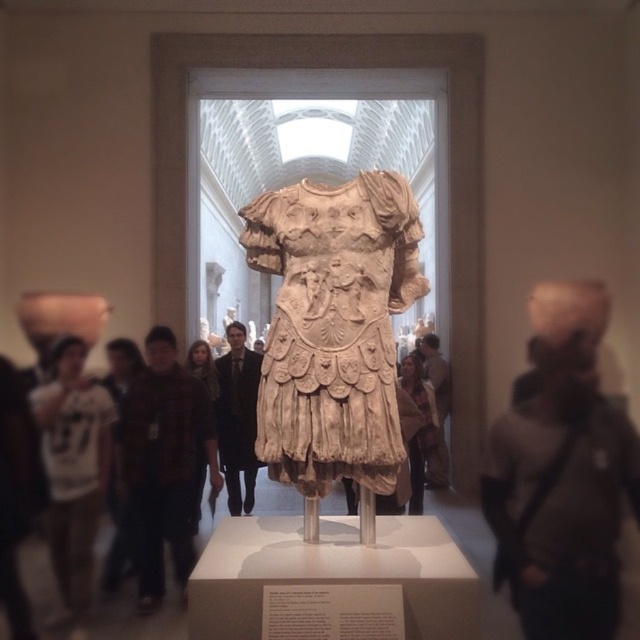
You are a tour guide leading a group through the museum. You notice two visitors wearing a black suit at center and a light brown leather jacket at center. Which visitor is closer to you?

The black suit at center is closer to you because it is further to the viewer than the light brown leather jacket at center.